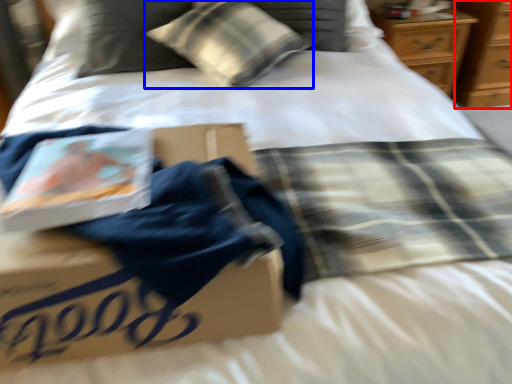
Question: Which object appears closest to the camera in this image, dresser (highlighted by a red box) or pillow (highlighted by a blue box)?

Choices:
 (A) dresser
 (B) pillow

Answer: (B)